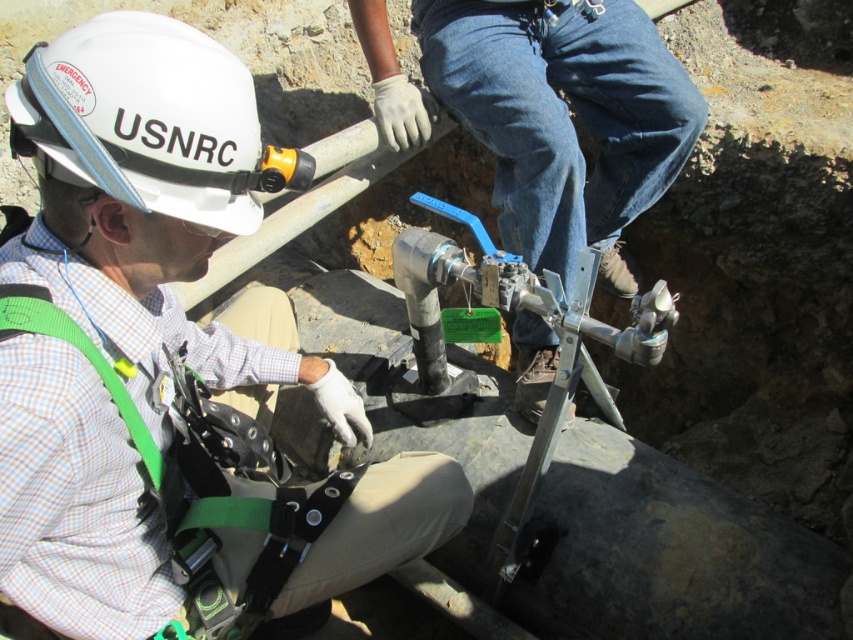
From the picture: Can you confirm if metallic silver valve at center is taller than white hard hat at upper left?

Yes.

Who is more distant from viewer, (646, 84) or (190, 198)?

The point (646, 84) is behind.

Does point (682, 138) lie in front of point (54, 77)?

No, (682, 138) is further to viewer.

Where is `metallic silver valve at center`? The width and height of the screenshot is (853, 640). metallic silver valve at center is located at coordinates (563, 116).